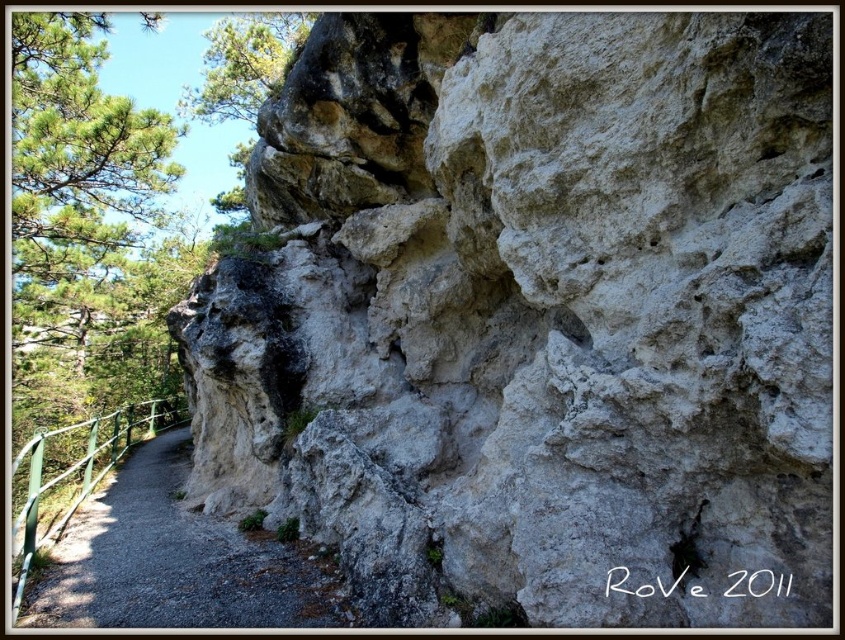
Describe the element at coordinates (173, 561) in the screenshot. I see `gray gravel path at lower left` at that location.

Is gray gravel path at lower left behind green metal rail at lower left?

No.

Locate an element on the screen. This screenshot has height=640, width=845. gray gravel path at lower left is located at coordinates (173, 561).

The image size is (845, 640). Find the location of `gray gravel path at lower left`. gray gravel path at lower left is located at coordinates (173, 561).

How far apart are green leafy tree at upper center and green metal rail at lower left?

The distance of green leafy tree at upper center from green metal rail at lower left is 4.22 meters.

Does green leafy tree at upper center have a greater height compared to green metal rail at lower left?

Yes, green leafy tree at upper center is taller than green metal rail at lower left.

Between point (298, 35) and point (106, 419), which one is positioned in front?

Positioned in front is point (298, 35).

Locate an element on the screen. green leafy tree at upper center is located at coordinates (244, 65).

Is gray gravel path at lower left further to the viewer compared to green leafy tree at upper center?

No, it is not.

The width and height of the screenshot is (845, 640). Describe the element at coordinates (173, 561) in the screenshot. I see `gray gravel path at lower left` at that location.

Between point (102, 492) and point (246, 156), which one is positioned in front?

Point (102, 492) is more forward.

I want to click on gray gravel path at lower left, so click(173, 561).